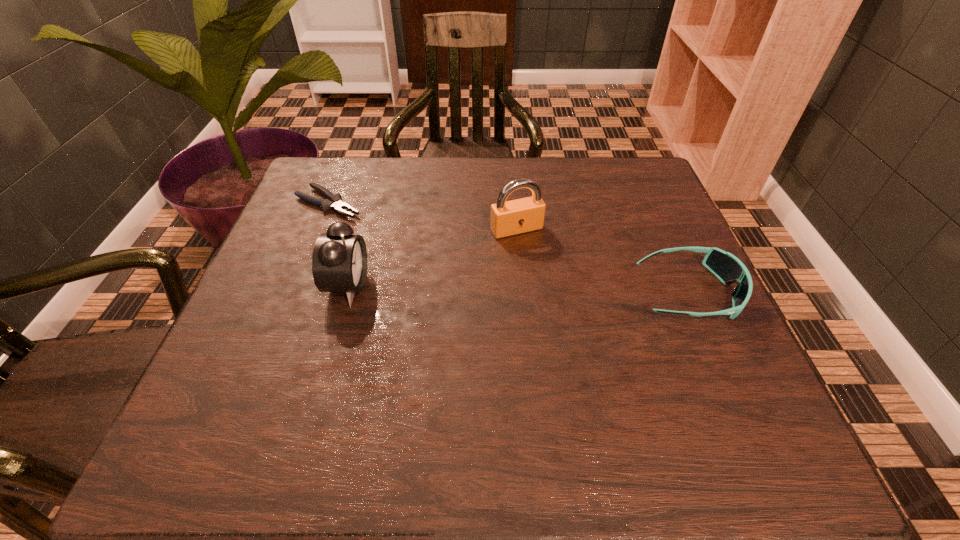
The height and width of the screenshot is (540, 960). Find the location of `free space at the right edge of the desktop`. free space at the right edge of the desktop is located at coordinates (660, 244).

I want to click on vacant area at the far left corner, so click(351, 178).

Where is `vacant space at the near right corner of the desktop`? vacant space at the near right corner of the desktop is located at coordinates click(683, 397).

Locate an element on the screen. This screenshot has width=960, height=540. vacant region between the padlock and the pliers is located at coordinates (422, 216).

Locate an element on the screen. This screenshot has width=960, height=540. unoccupied position between the third tallest object and the alarm clock is located at coordinates (518, 289).

Find the location of `free space between the rightmost object and the shortest object`. free space between the rightmost object and the shortest object is located at coordinates (509, 248).

Find the location of a particular element. This screenshot has width=960, height=540. free space between the third object from left to right and the rightmost object is located at coordinates (603, 261).

In order to click on free space between the alarm clock and the sunglasses in this screenshot , I will do `click(518, 289)`.

This screenshot has width=960, height=540. Identify the location of empty space that is in between the third object from left to right and the pliers. (422, 216).

At what (x,y) coordinates should I click in order to perform the action: click on free space between the rightmost object and the padlock. Please return your answer as a coordinate pair (x, y). This screenshot has height=540, width=960. Looking at the image, I should click on (603, 261).